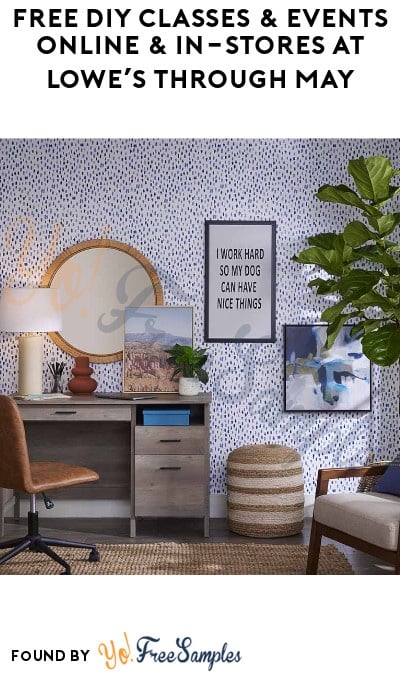
Image resolution: width=400 pixels, height=675 pixels. In order to click on floor in this screenshot , I will do `click(223, 536)`, `click(93, 530)`, `click(163, 565)`.